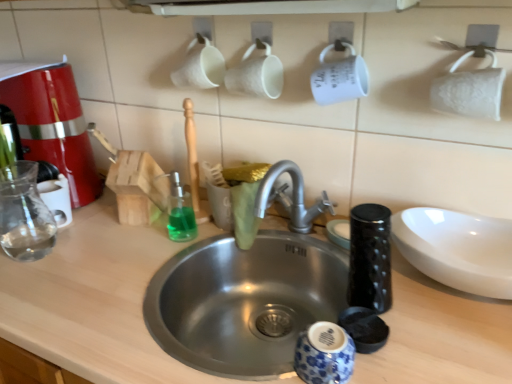
Identify the location of free space in front of green translucent liquid at sink. (145, 276).